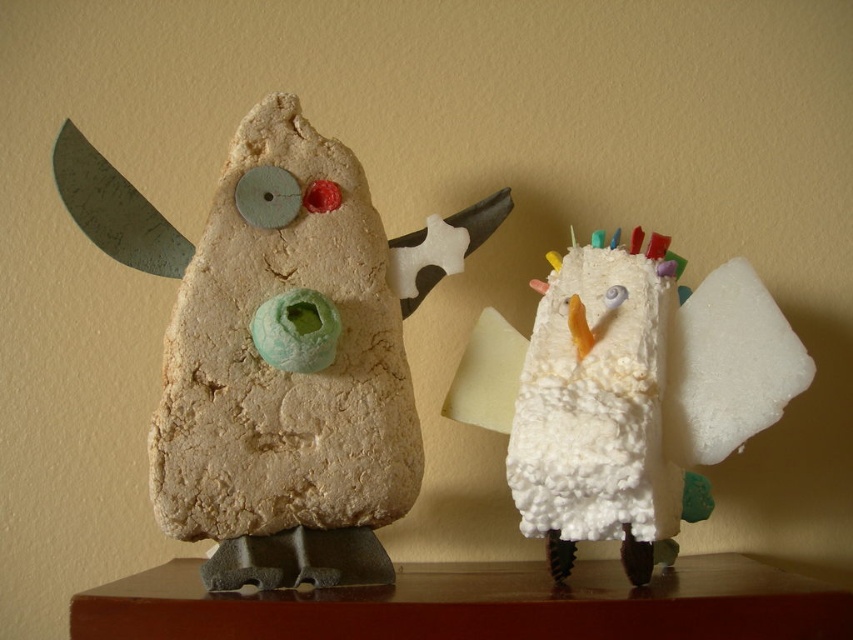
Does white fluffy bird at right have a lesser width compared to matte clay owl at left?

Indeed, white fluffy bird at right has a lesser width compared to matte clay owl at left.

Who is more forward, (549, 502) or (113, 172)?

Point (549, 502) is in front.

The width and height of the screenshot is (853, 640). In order to click on white fluffy bird at right in this screenshot , I will do `click(625, 392)`.